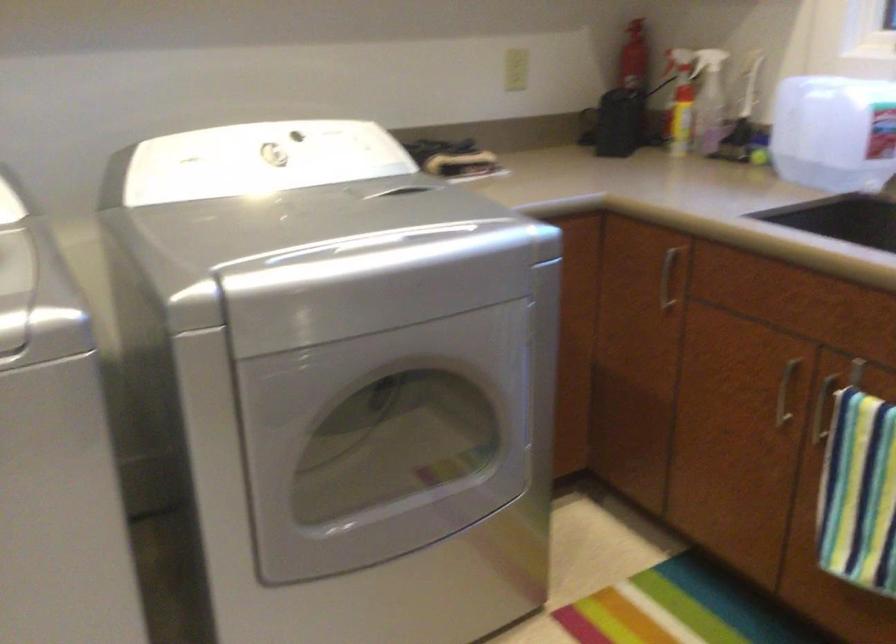
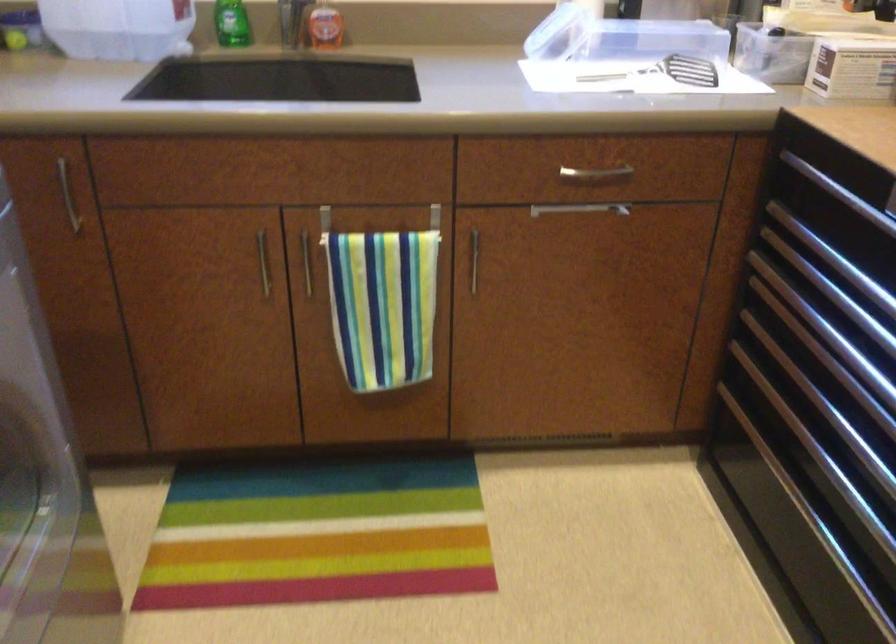
The first image is from the beginning of the video and the second image is from the end. How did the camera likely rotate when shooting the video?

The rotation direction of the camera is right-down.